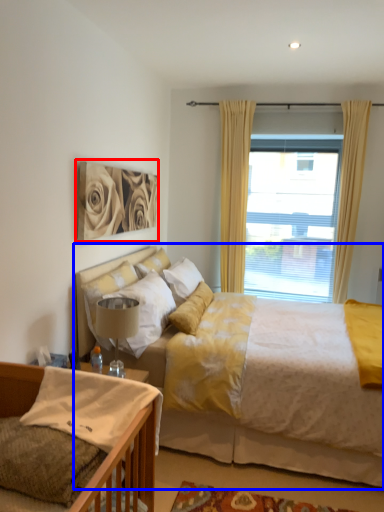
Question: Which point is closer to the camera, picture frame (highlighted by a red box) or bed (highlighted by a blue box)?

Choices:
 (A) picture frame
 (B) bed

Answer: (B)